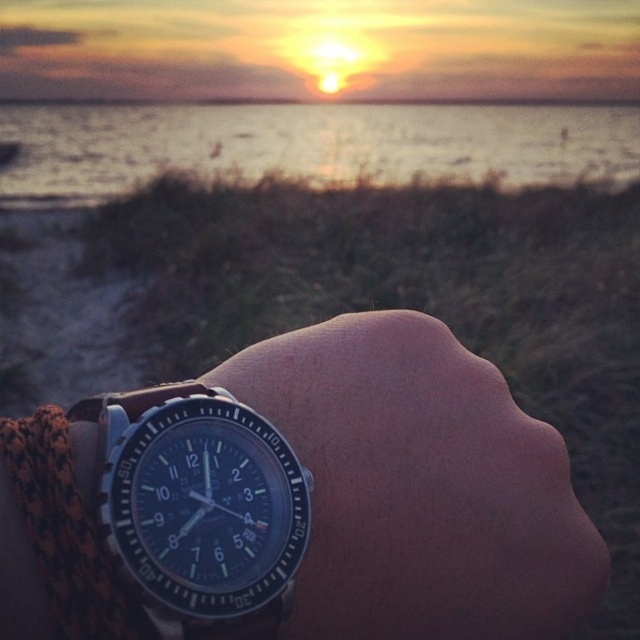
Measure the distance between matte water at center and camera.

matte water at center and camera are 66.68 feet apart from each other.

Can you confirm if matte water at center is positioned to the right of blue metallic watch at lower left?

In fact, matte water at center is to the left of blue metallic watch at lower left.

Where is `matte water at center`? This screenshot has width=640, height=640. matte water at center is located at coordinates (308, 145).

Does point (468, 561) lie behind point (92, 172)?

That is False.

Is black leather watch at center below matte water at center?

Indeed, black leather watch at center is positioned under matte water at center.

Is point (547, 570) positioned before point (269, 141)?

Yes, it is.

At what (x,y) coordinates should I click in order to perform the action: click on black leather watch at center. Please return your answer as a coordinate pair (x, y). Image resolution: width=640 pixels, height=640 pixels. Looking at the image, I should click on (420, 486).

Who is more forward, (x=266, y=358) or (x=248, y=502)?

Point (x=248, y=502)

Is black leather watch at center taller than blue metallic watch at lower left?

Indeed, black leather watch at center has a greater height compared to blue metallic watch at lower left.

Find the location of `black leather watch at center`. black leather watch at center is located at coordinates (420, 486).